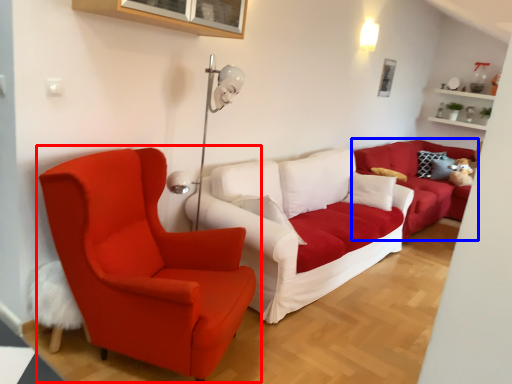
Question: Which point is further to the camera, chair (highlighted by a red box) or studio couch (highlighted by a blue box)?

Choices:
 (A) chair
 (B) studio couch

Answer: (B)